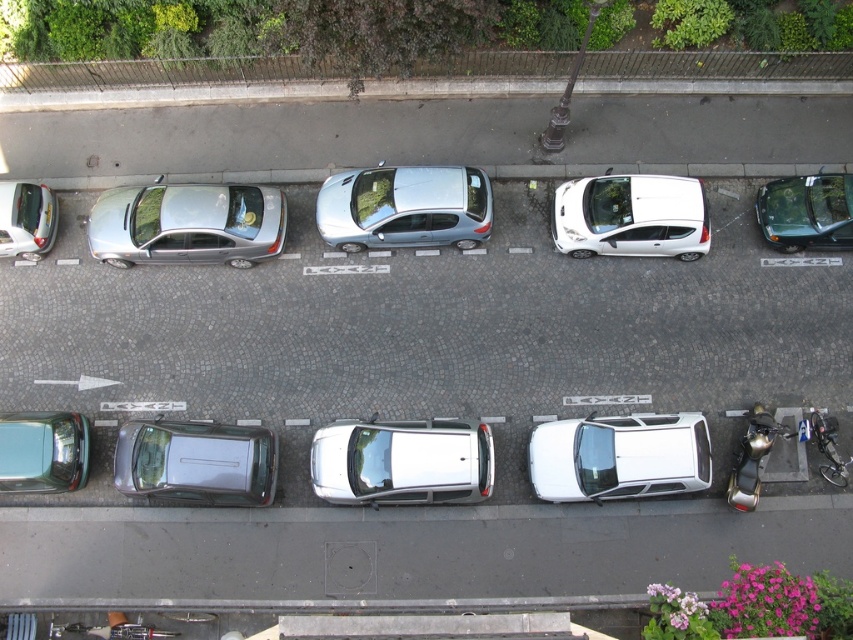
Based on the photo, you are standing on the balcony looking down at the street. You notice a specific point marked at coordinates [619,456]. Which object is this point located on?

The point at [619,456] is on the white glossy car at center.

In the scene shown: You are a delivery driver who needs to park your car in the parking space indicated by the white arrow. You see the white glossy hatchback at center and the metallic silver car at left. Which car is blocking your path to the parking space?

The metallic silver car at left is behind the white glossy hatchback at center, so the white glossy hatchback at center is blocking your path to the parking space indicated by the white arrow.

You are standing on the balcony and want to walk to the point marked as point (x=67, y=472). However, there is an obstacle at point (x=376, y=464). Can you walk directly to your destination without going around the obstacle?

Point (x=376, y=464) is in front of point (x=67, y=472), so you cannot walk directly to point (x=67, y=472) without going around the obstacle at point (x=376, y=464).